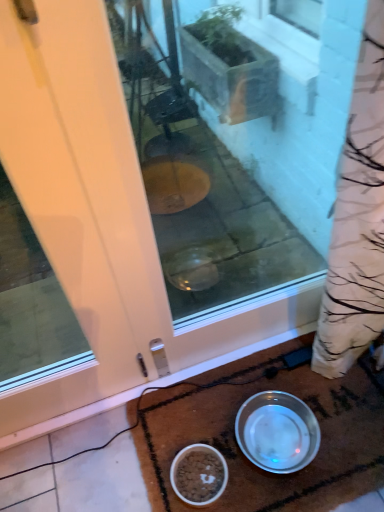
Identify the location of free space underneath brown textured doormat at lower center (from a real-world perspective). (313, 413).